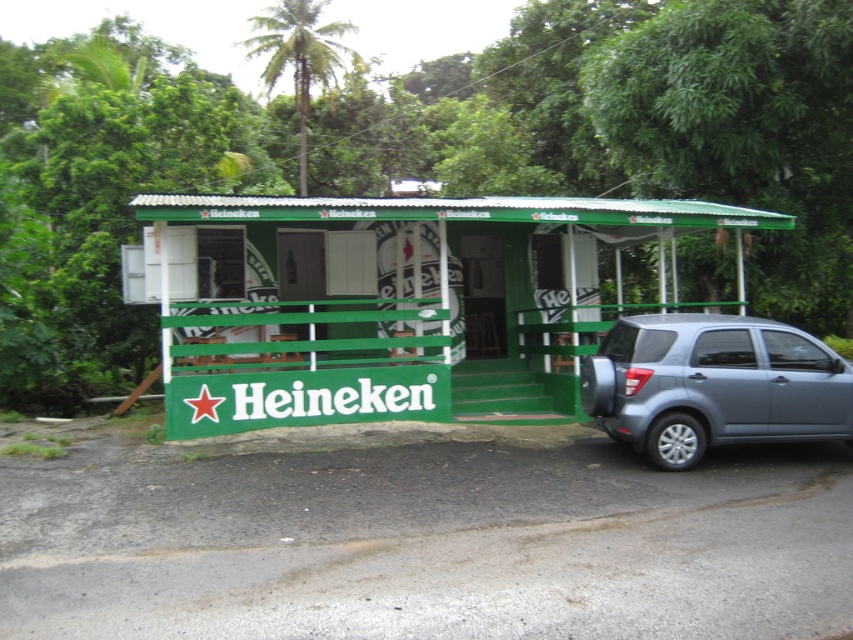
Is green painted wood hut at center shorter than gray metallic suv at right?

Yes.

Who is positioned more to the right, green painted wood hut at center or gray metallic suv at right?

gray metallic suv at right

Locate an element on the screen. Image resolution: width=853 pixels, height=640 pixels. green painted wood hut at center is located at coordinates (392, 301).